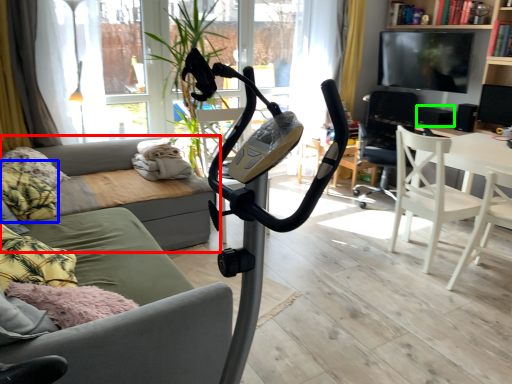
Question: Based on their relative distances, which object is farther from studio couch (highlighted by a red box)? Choose from pillow (highlighted by a blue box) and speaker (highlighted by a green box).

Choices:
 (A) pillow
 (B) speaker

Answer: (B)